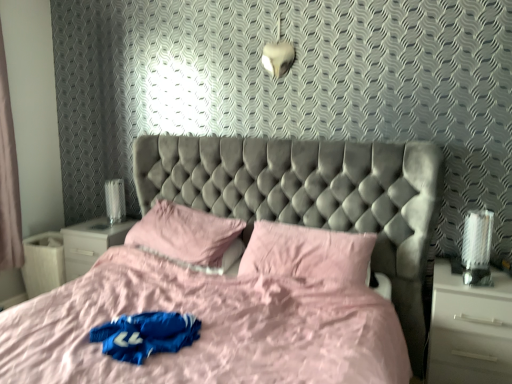
The height and width of the screenshot is (384, 512). I want to click on vacant space positioned to the left of white glossy table lamp at left, so click(91, 223).